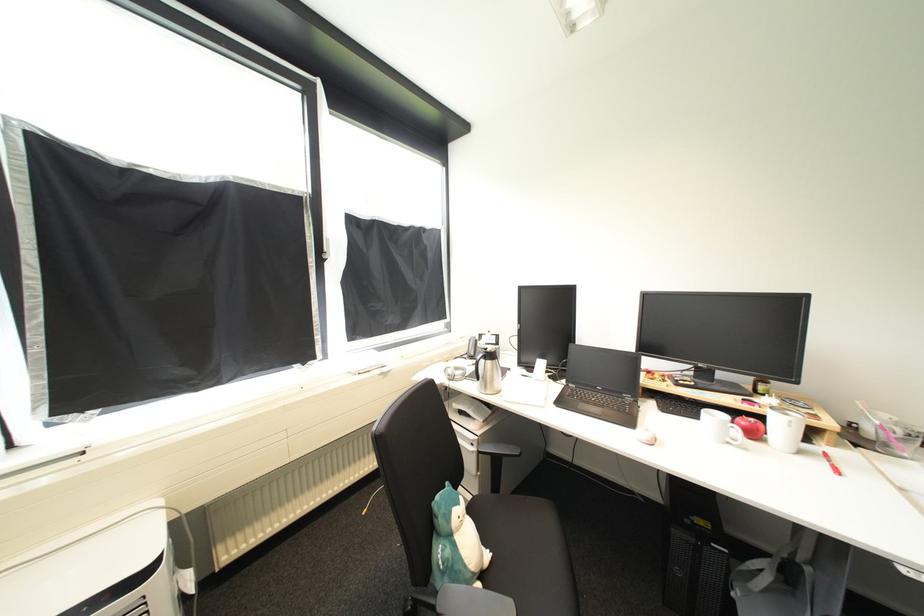
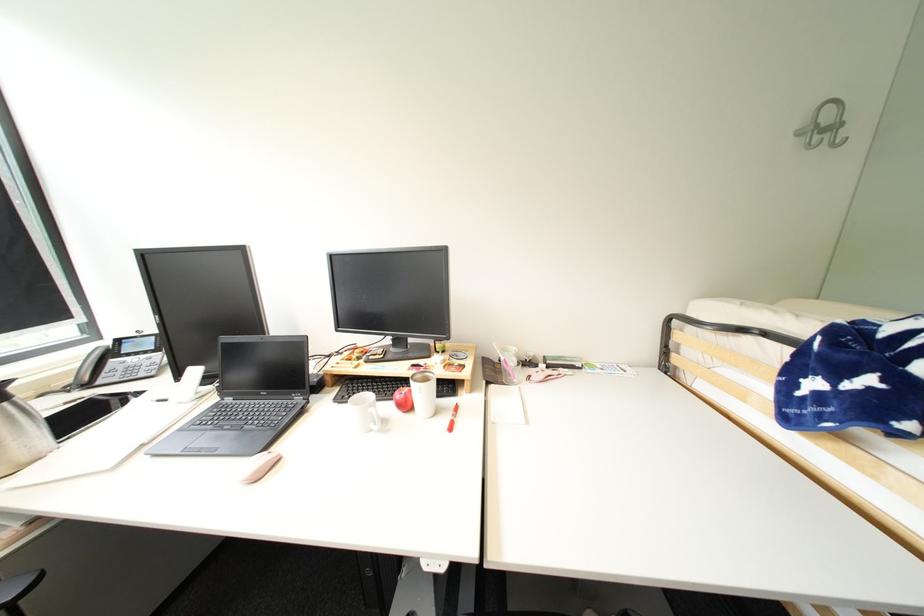
Question: How did the camera likely rotate?

Choices:
 (A) Left
 (B) Right
 (C) Up
 (D) Down

Answer: (B)